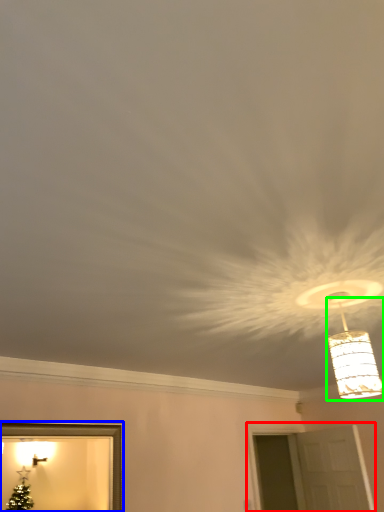
Question: Based on their relative distances, which object is nearer to window (highlighted by a red box)? Choose from picture frame (highlighted by a blue box) and lamp (highlighted by a green box).

Choices:
 (A) picture frame
 (B) lamp

Answer: (A)